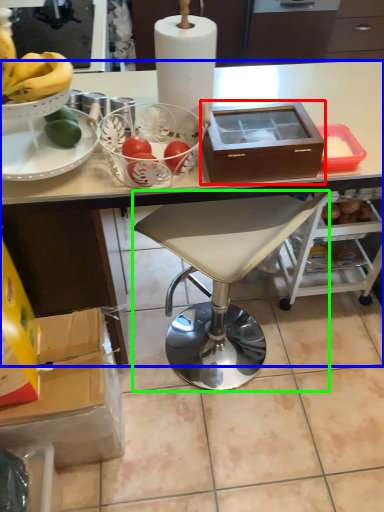
Question: Which object is the closest to the box (highlighted by a red box)? Choose among these: desk (highlighted by a blue box) or chair (highlighted by a green box).

Choices:
 (A) desk
 (B) chair

Answer: (A)